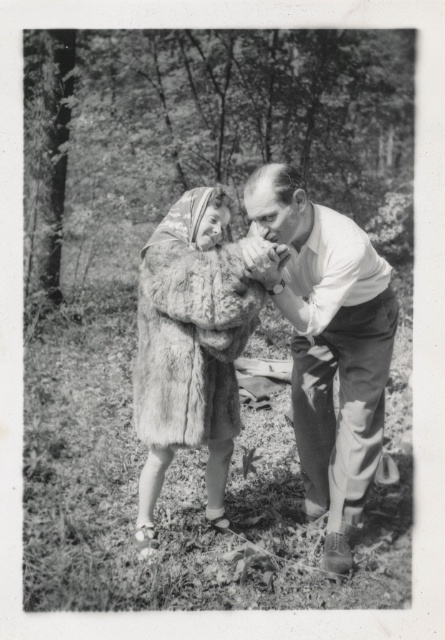
Based on the scene description, which object is positioned higher in the image between the smooth white shirt at center and the fuzzy fur coat at center?

The smooth white shirt at center is located above the fuzzy fur coat at center in the image.

You are a photographer trying to capture both the smooth white shirt at center and the fuzzy fur coat at center in a single frame. Based on their sizes, which object should you adjust your camera focus to ensure both are in frame?

The smooth white shirt at center might be wider than fuzzy fur coat at center, so you should adjust your camera focus to accommodate the wider object, which is the smooth white shirt at center.

You are standing in a forest and see two points marked in the image. The first point is at coordinates point (272, 216) and the second is at point (210, 406). Which point is closer to you?

Point (272, 216) is closer to the camera than point (210, 406).